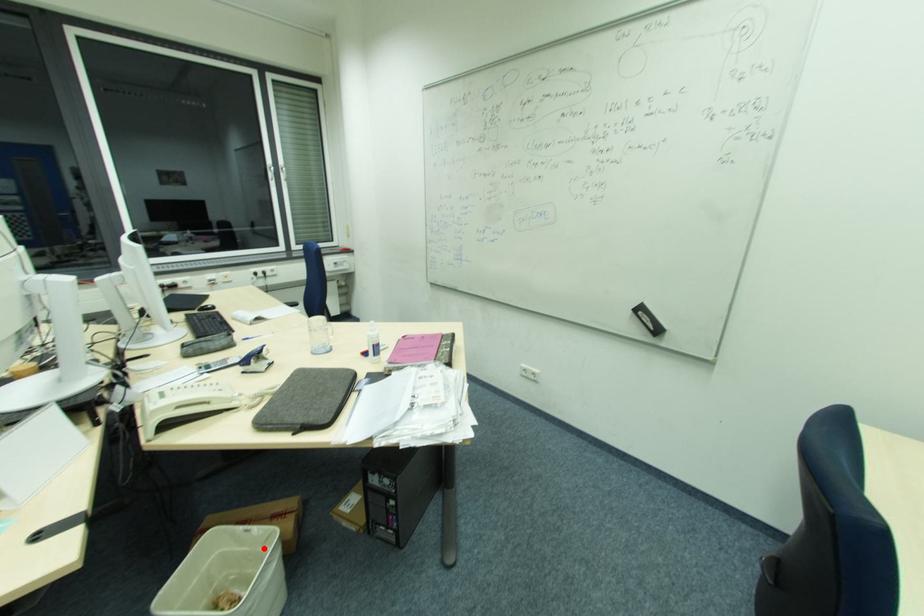
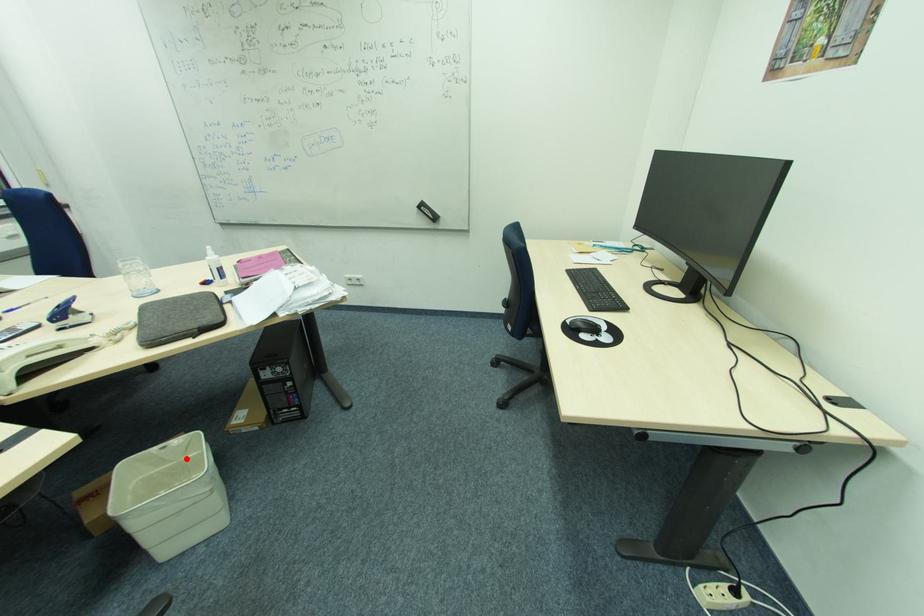
I am providing you with two images of the same scene from different viewpoints. A red point is marked on the first image and another point is marked on the second image. Do the highlighted points in image1 and image2 indicate the same real-world spot?

Yes